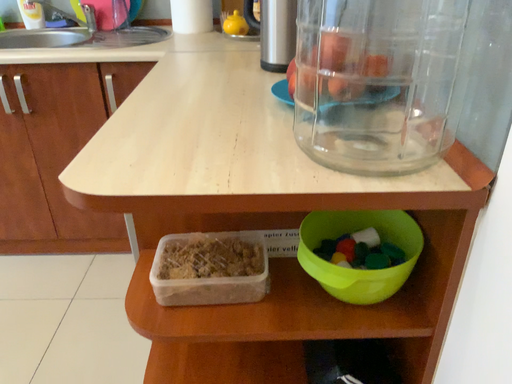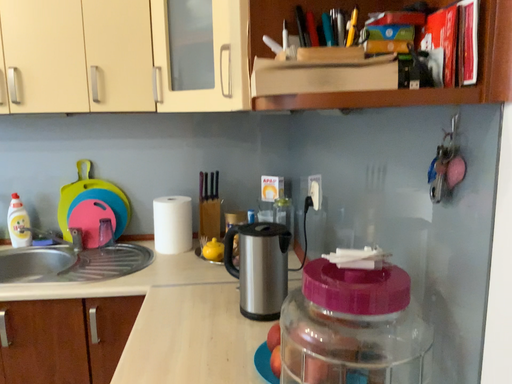
Question: Which way did the camera rotate in the video?

Choices:
 (A) rotated downward
 (B) rotated upward

Answer: (B)